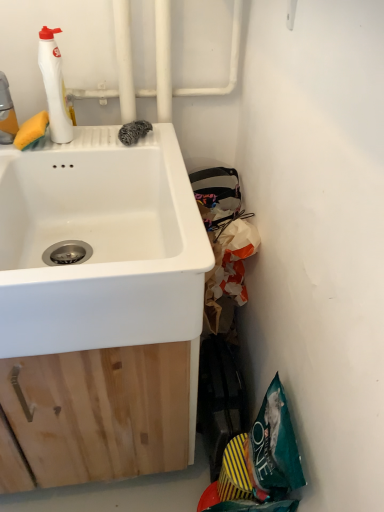
Question: Is translucent white bottle at upper left, which ranks as the 2th cleaning product in right-to-left order, to the right of white matte bottle at upper left, which is the first cleaning product in right-to-left order, from the viewer's perspective?

Choices:
 (A) yes
 (B) no

Answer: (B)

Question: From the image's perspective, is translucent white bottle at upper left, which is the 1th cleaning product from left to right, on white matte bottle at upper left, which is the first cleaning product in right-to-left order?

Choices:
 (A) no
 (B) yes

Answer: (A)

Question: Does translucent white bottle at upper left, which is the 1th cleaning product from left to right, have a lesser width compared to white matte bottle at upper left, which ranks as the second cleaning product in left-to-right order?

Choices:
 (A) yes
 (B) no

Answer: (B)

Question: Is translucent white bottle at upper left, which ranks as the 2th cleaning product in right-to-left order, bigger than white matte bottle at upper left, which is the first cleaning product in right-to-left order?

Choices:
 (A) no
 (B) yes

Answer: (B)

Question: From a real-world perspective, does translucent white bottle at upper left, which ranks as the 2th cleaning product in right-to-left order, sit lower than white matte bottle at upper left, which ranks as the second cleaning product in left-to-right order?

Choices:
 (A) yes
 (B) no

Answer: (A)

Question: From the image's perspective, relative to translucent white bottle at upper left, which ranks as the 2th cleaning product in right-to-left order, is teal fabric bag at lower right above or below?

Choices:
 (A) below
 (B) above

Answer: (A)

Question: Based on their sizes in the image, would you say teal fabric bag at lower right is bigger or smaller than translucent white bottle at upper left, which is the 1th cleaning product from left to right?

Choices:
 (A) small
 (B) big

Answer: (B)

Question: From a real-world perspective, relative to translucent white bottle at upper left, which is the 1th cleaning product from left to right, is teal fabric bag at lower right vertically above or below?

Choices:
 (A) below
 (B) above

Answer: (A)

Question: Would you say teal fabric bag at lower right is to the left or to the right of translucent white bottle at upper left, which ranks as the 2th cleaning product in right-to-left order, in the picture?

Choices:
 (A) left
 (B) right

Answer: (B)

Question: From the image's perspective, is white ceramic sink at upper left positioned above or below teal fabric bag at lower right?

Choices:
 (A) below
 (B) above

Answer: (B)

Question: Considering their positions, is white ceramic sink at upper left located in front of or behind teal fabric bag at lower right?

Choices:
 (A) behind
 (B) front

Answer: (B)

Question: From a real-world perspective, relative to teal fabric bag at lower right, is white ceramic sink at upper left vertically above or below?

Choices:
 (A) below
 (B) above

Answer: (B)

Question: Is white ceramic sink at upper left spatially inside teal fabric bag at lower right, or outside of it?

Choices:
 (A) outside
 (B) inside

Answer: (A)

Question: Which is correct: teal fabric bag at lower right is inside white matte bottle at upper left, which is the first cleaning product in right-to-left order, or outside of it?

Choices:
 (A) inside
 (B) outside

Answer: (B)

Question: Looking at their shapes, would you say teal fabric bag at lower right is wider or thinner than white matte bottle at upper left, which ranks as the second cleaning product in left-to-right order?

Choices:
 (A) thin
 (B) wide

Answer: (B)